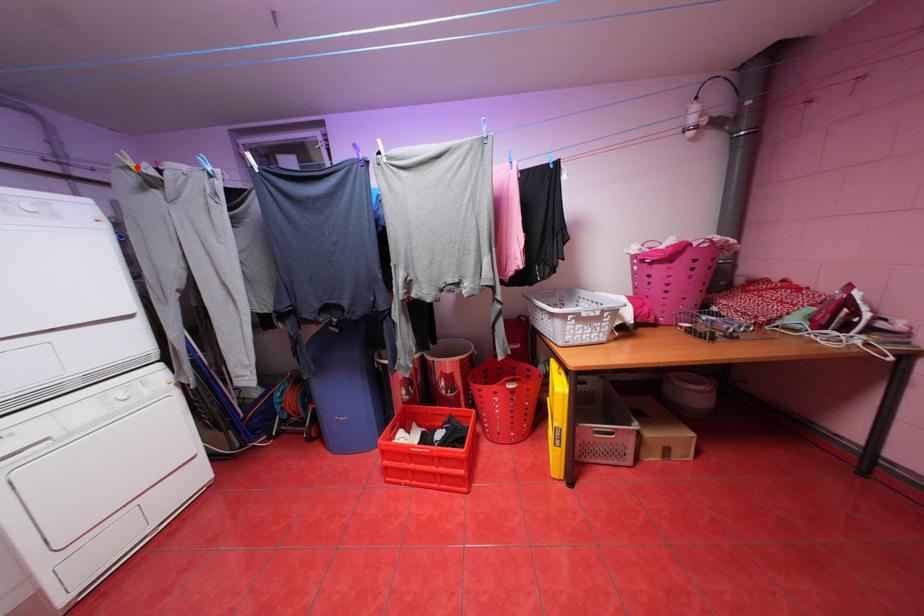
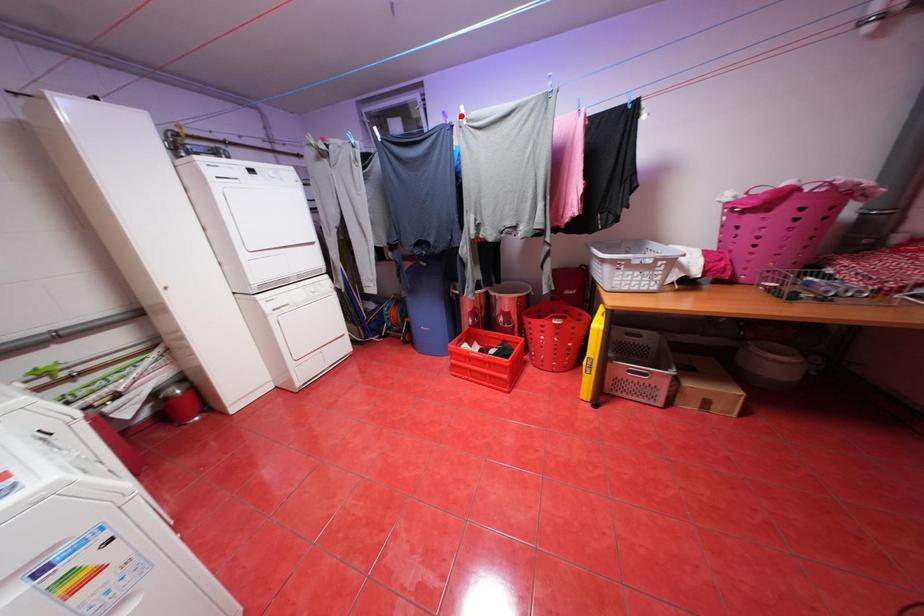
I am providing you with two images of the same scene from different viewpoints. A red point is marked on the first image and another point is marked on the second image. Are the points marked in image1 and image2 representing the same 3D position?

No